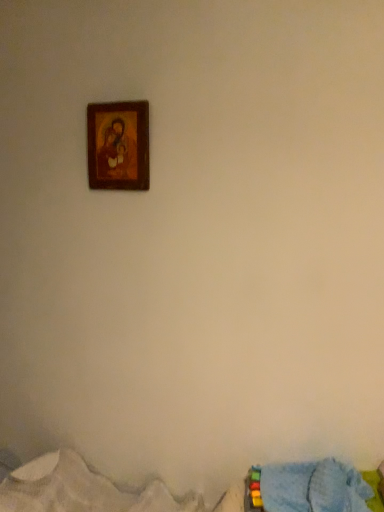
Question: Is blue fabric bed at lower right, which is the second bed from bottom to top, touching blue textured blanket at lower right, arranged as the first bed when ordered from the bottom?

Choices:
 (A) no
 (B) yes

Answer: (A)

Question: Does blue fabric bed at lower right, which is the second bed from bottom to top, lie in front of blue textured blanket at lower right, arranged as the first bed when ordered from the bottom?

Choices:
 (A) no
 (B) yes

Answer: (A)

Question: Can you confirm if blue fabric bed at lower right, which is the second bed from bottom to top, is bigger than blue textured blanket at lower right, which is counted as the second bed, starting from the top?

Choices:
 (A) yes
 (B) no

Answer: (B)

Question: Considering the relative sizes of blue fabric bed at lower right, which is the second bed from bottom to top, and blue textured blanket at lower right, arranged as the first bed when ordered from the bottom, in the image provided, is blue fabric bed at lower right, which is the second bed from bottom to top, wider than blue textured blanket at lower right, arranged as the first bed when ordered from the bottom,?

Choices:
 (A) no
 (B) yes

Answer: (A)

Question: From the image's perspective, does blue fabric bed at lower right, which is the second bed from bottom to top, appear lower than blue textured blanket at lower right, which is counted as the second bed, starting from the top?

Choices:
 (A) yes
 (B) no

Answer: (B)

Question: From the image's perspective, relative to wooden frame at upper center, is blue fabric bed at lower right, marked as the 1th bed in a top-to-bottom arrangement, above or below?

Choices:
 (A) above
 (B) below

Answer: (B)

Question: In terms of width, does blue fabric bed at lower right, marked as the 1th bed in a top-to-bottom arrangement, look wider or thinner when compared to wooden frame at upper center?

Choices:
 (A) wide
 (B) thin

Answer: (A)

Question: Does point (327, 489) appear closer or farther from the camera than point (92, 168)?

Choices:
 (A) farther
 (B) closer

Answer: (B)

Question: In terms of height, does blue fabric bed at lower right, which is the second bed from bottom to top, look taller or shorter compared to wooden frame at upper center?

Choices:
 (A) short
 (B) tall

Answer: (A)

Question: Visually, is wooden frame at upper center positioned to the left or to the right of blue fabric bed at lower right, marked as the 1th bed in a top-to-bottom arrangement?

Choices:
 (A) left
 (B) right

Answer: (A)

Question: From the image's perspective, is wooden frame at upper center positioned above or below blue fabric bed at lower right, which is the second bed from bottom to top?

Choices:
 (A) above
 (B) below

Answer: (A)

Question: Does point (127, 172) appear closer or farther from the camera than point (334, 477)?

Choices:
 (A) farther
 (B) closer

Answer: (A)

Question: Considering their positions, is wooden frame at upper center located in front of or behind blue fabric bed at lower right, marked as the 1th bed in a top-to-bottom arrangement?

Choices:
 (A) front
 (B) behind

Answer: (B)

Question: From the image's perspective, relative to wooden frame at upper center, is blue textured blanket at lower right, arranged as the first bed when ordered from the bottom, above or below?

Choices:
 (A) below
 (B) above

Answer: (A)

Question: Based on their sizes in the image, would you say blue textured blanket at lower right, arranged as the first bed when ordered from the bottom, is bigger or smaller than wooden frame at upper center?

Choices:
 (A) small
 (B) big

Answer: (B)